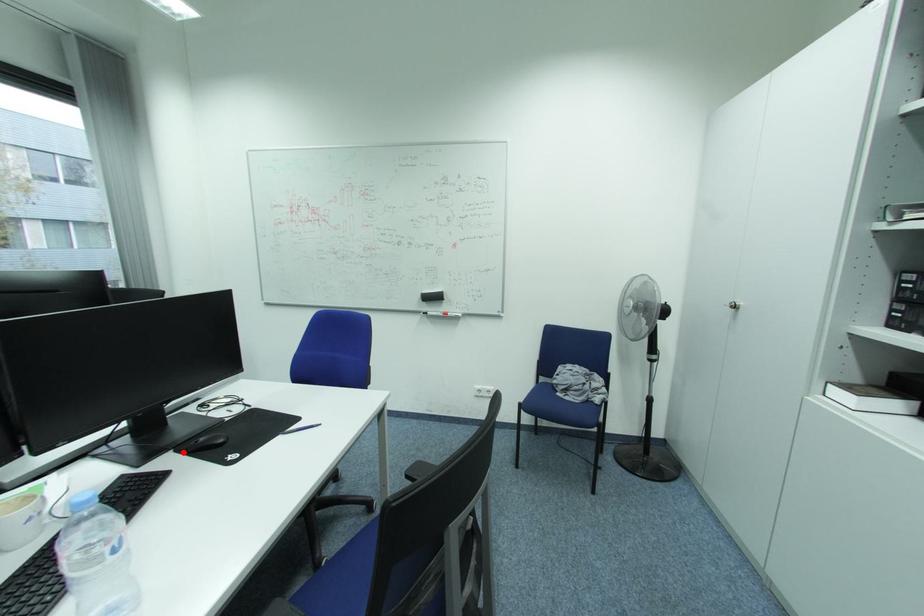
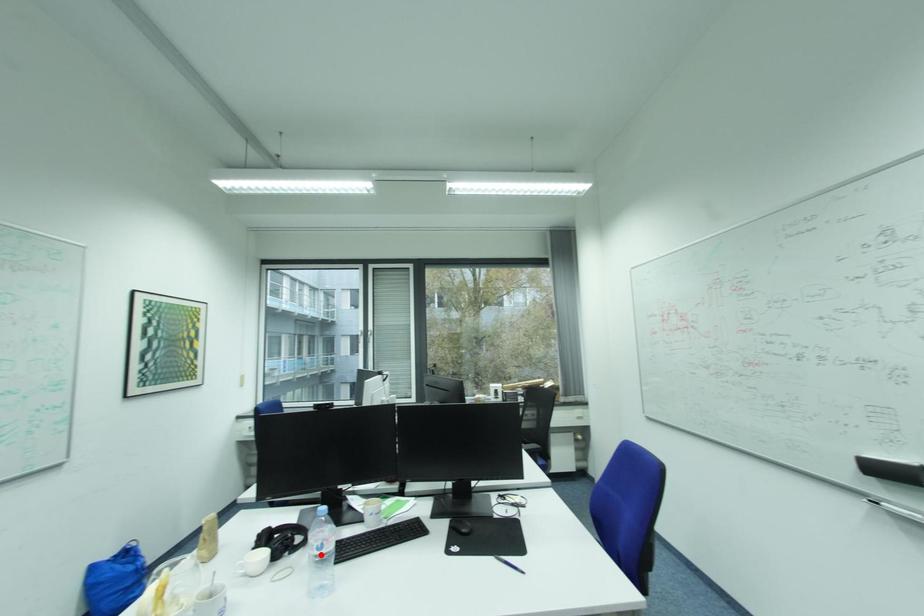
I am providing you with two images of the same scene from different viewpoints. A red point is marked on the first image and another point is marked on the second image. Is the red point in image1 aligned with the point shown in image2?

No